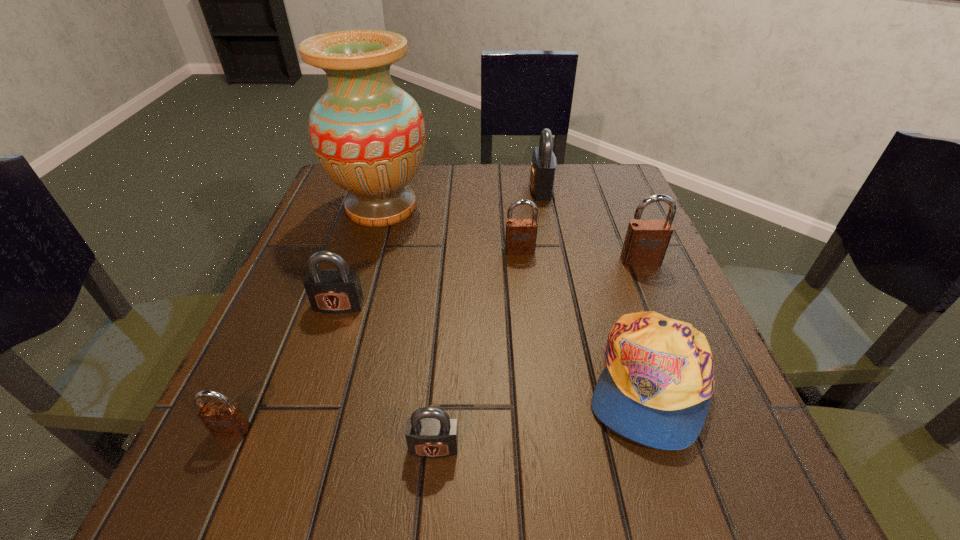
What are the coordinates of `object present at the near right corner` in the screenshot? It's located at (656, 388).

In the image, there is a desktop. At what (x,y) coordinates should I click in order to perform the action: click on free space at the far edge. Please return your answer as a coordinate pair (x, y). Looking at the image, I should click on (480, 181).

Locate an element on the screen. The image size is (960, 540). blank space at the near edge of the desktop is located at coordinates (569, 502).

In the image, there is a desktop. Where is `vacant region at the left edge`? The image size is (960, 540). vacant region at the left edge is located at coordinates (349, 336).

Where is `free point at the right edge`? free point at the right edge is located at coordinates (658, 298).

Locate an element on the screen. free space at the far right corner of the desktop is located at coordinates (583, 185).

Where is `free region at the near right corner of the desktop`? free region at the near right corner of the desktop is located at coordinates (716, 521).

Locate an element on the screen. The image size is (960, 540). vacant area between the fourth padlock from right to left and the leftmost brown padlock is located at coordinates (333, 438).

You are a GUI agent. You are given a task and a screenshot of the screen. Output one action in this format:
    pyautogui.click(x=<x>, y=<y>)
    Task: Click on the empty space that is in between the leftmost gray padlock and the fifth nearest padlock
    
    Given the screenshot: What is the action you would take?
    pyautogui.click(x=429, y=278)

Image resolution: width=960 pixels, height=540 pixels. Find the location of `empty space that is in between the fifth farthest object and the farthest brown padlock`. empty space that is in between the fifth farthest object and the farthest brown padlock is located at coordinates (429, 278).